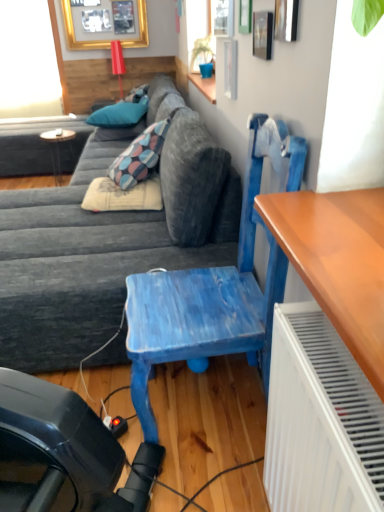
Question: From a real-world perspective, is gold framed picture at upper left positioned over blue painted wood chair at center based on gravity?

Choices:
 (A) yes
 (B) no

Answer: (A)

Question: Is gold framed picture at upper left positioned with its back to blue painted wood chair at center?

Choices:
 (A) no
 (B) yes

Answer: (A)

Question: From a real-world perspective, is gold framed picture at upper left beneath blue painted wood chair at center?

Choices:
 (A) no
 (B) yes

Answer: (A)

Question: Considering the relative positions of gold framed picture at upper left and blue painted wood chair at center in the image provided, is gold framed picture at upper left to the left of blue painted wood chair at center from the viewer's perspective?

Choices:
 (A) no
 (B) yes

Answer: (B)

Question: Is gold framed picture at upper left at the right side of blue painted wood chair at center?

Choices:
 (A) yes
 (B) no

Answer: (B)

Question: Is gold framed picture at upper left positioned before blue painted wood chair at center?

Choices:
 (A) no
 (B) yes

Answer: (A)

Question: Is clear glass window at upper center positioned before beige fabric pillow at center, marked as the 1th pillow in a bottom-to-top arrangement?

Choices:
 (A) yes
 (B) no

Answer: (A)

Question: Is clear glass window at upper center at the right side of beige fabric pillow at center, positioned as the first pillow in front-to-back order?

Choices:
 (A) yes
 (B) no

Answer: (A)

Question: Does clear glass window at upper center have a lesser width compared to beige fabric pillow at center, which appears as the third pillow when viewed from the top?

Choices:
 (A) yes
 (B) no

Answer: (A)

Question: Is clear glass window at upper center turned away from beige fabric pillow at center, which appears as the third pillow when viewed from the top?

Choices:
 (A) yes
 (B) no

Answer: (B)

Question: Can you confirm if clear glass window at upper center is shorter than beige fabric pillow at center, which appears as the third pillow when viewed from the top?

Choices:
 (A) yes
 (B) no

Answer: (B)

Question: Does clear glass window at upper center have a larger size compared to beige fabric pillow at center, placed as the third pillow when sorted from back to front?

Choices:
 (A) yes
 (B) no

Answer: (B)

Question: From a real-world perspective, does clear glass window at upper center stand above wooden round table at left?

Choices:
 (A) no
 (B) yes

Answer: (B)